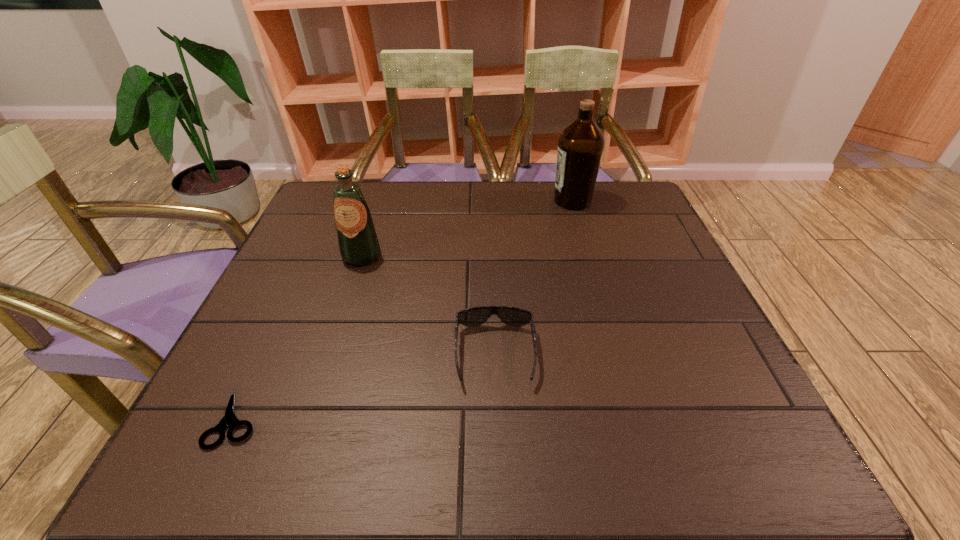
Find the location of a particular element. The image size is (960, 540). blank space that satisfies the following two spatial constraints: 1. on the label of the farthest object; 2. on the front-facing side of the third shortest object is located at coordinates (589, 256).

Identify the location of free space that satisfies the following two spatial constraints: 1. on the label of the taller olive oil; 2. on the front-facing side of the third object from left to right. The height and width of the screenshot is (540, 960). (618, 354).

This screenshot has height=540, width=960. Identify the location of free space that satisfies the following two spatial constraints: 1. on the label of the taller olive oil; 2. on the front-facing side of the second shortest object. (618, 354).

The width and height of the screenshot is (960, 540). I want to click on free space that satisfies the following two spatial constraints: 1. on the label of the tallest object; 2. on the front-facing side of the shorter olive oil, so tap(589, 256).